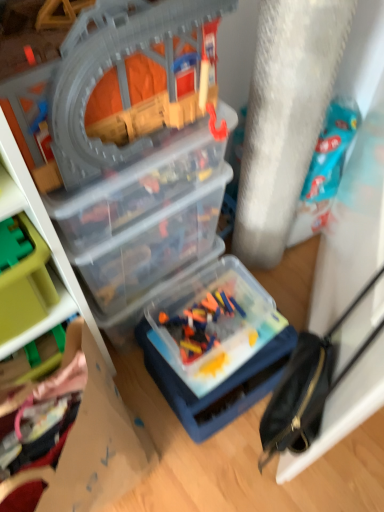
Question: Can you confirm if green plastic toy at left, acting as the 3th toy starting from the bottom, is taller than translucent plastic container at center, the 2th toy from the bottom?

Choices:
 (A) no
 (B) yes

Answer: (B)

Question: Can you confirm if green plastic toy at left, which is counted as the third toy, starting from the top, is bigger than translucent plastic container at center, the 2th toy from the bottom?

Choices:
 (A) yes
 (B) no

Answer: (B)

Question: Is green plastic toy at left, which is counted as the third toy, starting from the top, closer to the viewer compared to translucent plastic container at center, the 2th toy from the bottom?

Choices:
 (A) yes
 (B) no

Answer: (A)

Question: From a real-world perspective, is green plastic toy at left, which is counted as the third toy, starting from the top, positioned under translucent plastic container at center, the 2th toy from the bottom, based on gravity?

Choices:
 (A) no
 (B) yes

Answer: (A)

Question: Can you confirm if green plastic toy at left, acting as the 3th toy starting from the bottom, is positioned to the left of translucent plastic container at center, placed as the fourth toy when sorted from top to bottom?

Choices:
 (A) no
 (B) yes

Answer: (B)

Question: From the image's perspective, would you say green plastic toy at left, acting as the 3th toy starting from the bottom, is shown under translucent plastic container at center, placed as the fourth toy when sorted from top to bottom?

Choices:
 (A) no
 (B) yes

Answer: (A)

Question: Is transparent plastic toy box at upper left, the 1th box when ordered from front to back, completely or partially outside of black leather bag at right?

Choices:
 (A) no
 (B) yes

Answer: (B)

Question: Does transparent plastic toy box at upper left, arranged as the second box when viewed from the back, appear on the left side of black leather bag at right?

Choices:
 (A) yes
 (B) no

Answer: (A)

Question: From a real-world perspective, is transparent plastic toy box at upper left, the 1th box when ordered from front to back, located beneath black leather bag at right?

Choices:
 (A) no
 (B) yes

Answer: (B)

Question: Is transparent plastic toy box at upper left, the 1th box when ordered from front to back, surrounding black leather bag at right?

Choices:
 (A) yes
 (B) no

Answer: (B)

Question: Considering the relative sizes of transparent plastic toy box at upper left, the 1th box when ordered from front to back, and black leather bag at right in the image provided, is transparent plastic toy box at upper left, the 1th box when ordered from front to back, smaller than black leather bag at right?

Choices:
 (A) no
 (B) yes

Answer: (A)

Question: Is the position of transparent plastic toy box at upper left, the 1th box when ordered from front to back, more distant than that of black leather bag at right?

Choices:
 (A) no
 (B) yes

Answer: (B)

Question: From the image's perspective, would you say transparent plastic toy box at upper left, arranged as the second box when viewed from the back, is shown under translucent plastic container at center, the 2th toy from the bottom?

Choices:
 (A) yes
 (B) no

Answer: (B)